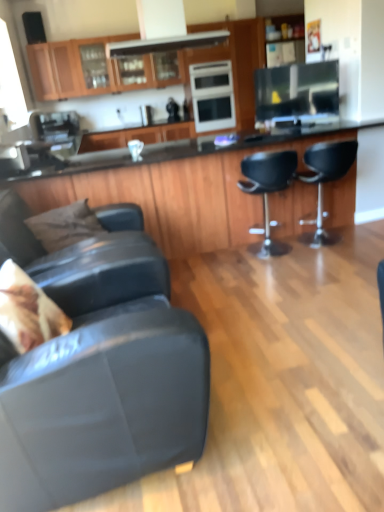
Locate an element on the screen. Image resolution: width=384 pixels, height=512 pixels. vacant space situated on the left part of black leather bar stool at center, marked as the 3th chair in a left-to-right arrangement is located at coordinates (213, 261).